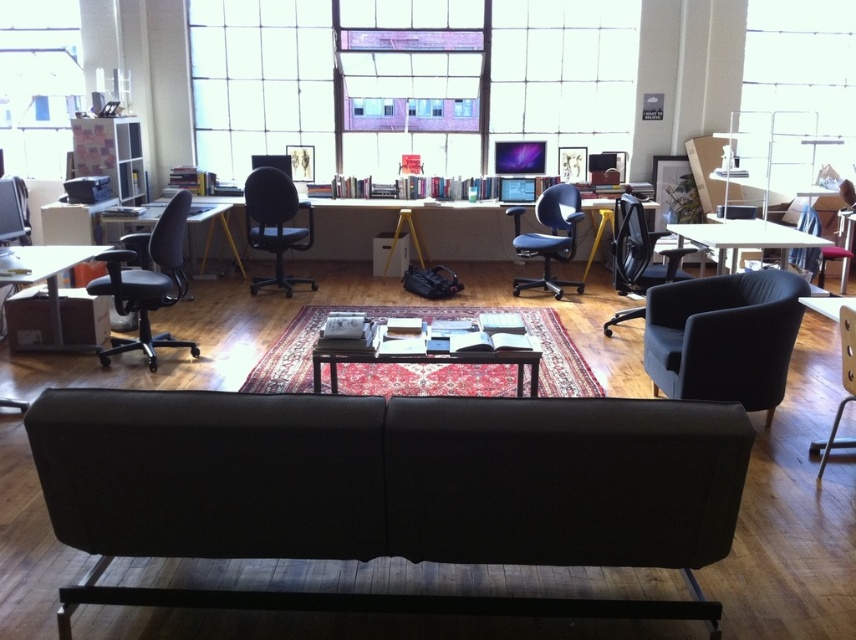
Question: Among these objects, which one is nearest to the camera?

Choices:
 (A) black fabric office chair at left
 (B) wooden table at center
 (C) matte black desk at center
 (D) matte black table at left

Answer: (B)

Question: Is wooden table at center wider than matte wood bookshelf at left?

Choices:
 (A) no
 (B) yes

Answer: (B)

Question: Is the position of matte wood bookshelf at left less distant than that of matte black armchair at right?

Choices:
 (A) yes
 (B) no

Answer: (B)

Question: Which of the following is the farthest from the observer?

Choices:
 (A) (693, 236)
 (B) (138, 333)
 (C) (128, 170)

Answer: (C)

Question: Is clear glass window at upper center above black fabric office chair at left?

Choices:
 (A) yes
 (B) no

Answer: (A)

Question: Among these objects, which one is farthest from the camera?

Choices:
 (A) wooden table at center
 (B) black fabric office chair at left
 (C) matte black office chair at center

Answer: (C)